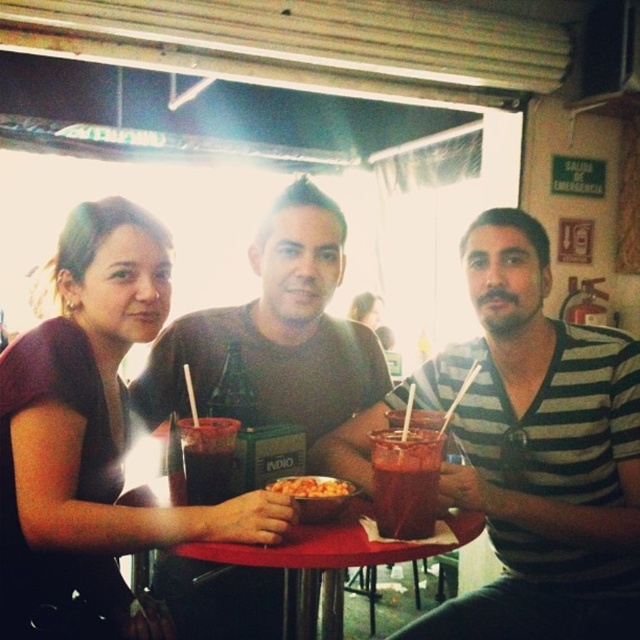
Question: Estimate the real-world distances between objects in this image. Which object is closer to the dark red glass at center?

Choices:
 (A) matte brown shirt at center
 (B) matte purple shirt at left
 (C) translucent glass drink at center

Answer: (B)

Question: Observing the image, what is the correct spatial positioning of matte brown shirt at center in reference to red plastic table at center?

Choices:
 (A) below
 (B) above

Answer: (B)

Question: Estimate the real-world distances between objects in this image. Which object is farther from the dark red glass at center?

Choices:
 (A) shiny plastic bowl of pasta at center
 (B) matte purple shirt at left
 (C) matte brown shirt at center
 (D) striped cotton shirt at center

Answer: (D)

Question: Is matte brown shirt at center positioned in front of shiny plastic bowl of pasta at center?

Choices:
 (A) no
 (B) yes

Answer: (A)

Question: Considering the real-world distances, which object is farthest from the matte brown shirt at center?

Choices:
 (A) matte purple shirt at left
 (B) striped cotton shirt at center
 (C) red plastic table at center
 (D) translucent glass drink at center

Answer: (C)

Question: Is striped cotton shirt at center to the right of translucent glass drink at center from the viewer's perspective?

Choices:
 (A) yes
 (B) no

Answer: (A)